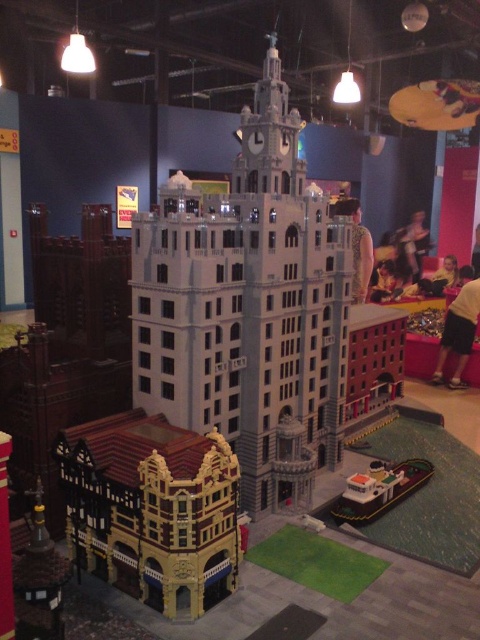
Question: Can you confirm if light gray lego tower at center is positioned above white plastic boat at lower right?

Choices:
 (A) no
 (B) yes

Answer: (B)

Question: Which of these objects is positioned closest to the brown textured building at lower left?

Choices:
 (A) white plastic boat at lower right
 (B) light gray lego tower at center

Answer: (B)

Question: Which object is farther from the camera taking this photo?

Choices:
 (A) light gray lego tower at center
 (B) white plastic boat at lower right
 (C) brown textured building at lower left

Answer: (B)

Question: Which point is farther from the camera taking this photo?

Choices:
 (A) (385, 497)
 (B) (337, 378)
 (C) (71, 518)

Answer: (B)

Question: In this image, where is light gray lego tower at center located relative to brown textured building at lower left?

Choices:
 (A) below
 (B) above

Answer: (B)

Question: Observing the image, what is the correct spatial positioning of light gray lego tower at center in reference to brown textured building at lower left?

Choices:
 (A) right
 (B) left

Answer: (A)